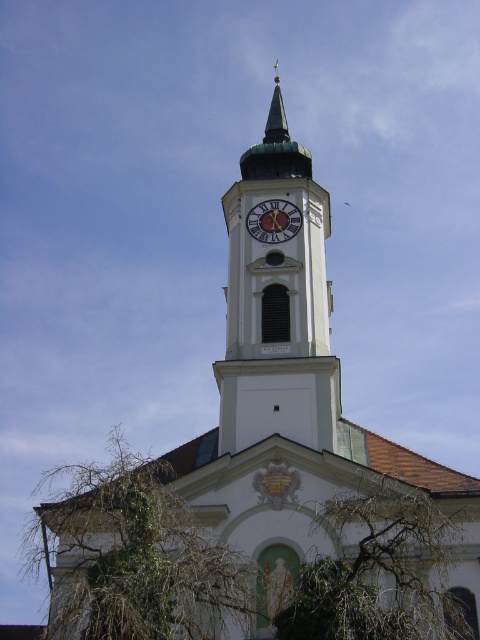
You are standing in front of the church tower and want to take a photo that includes both the white stone clock tower at center and the gold metallic clock at center. Which object should you position to the right side of your camera frame to ensure both are visible?

The white stone clock tower at center should be positioned to the right side of your camera frame because it is already to the right of the gold metallic clock at center, so placing it on the right will include both in the frame.